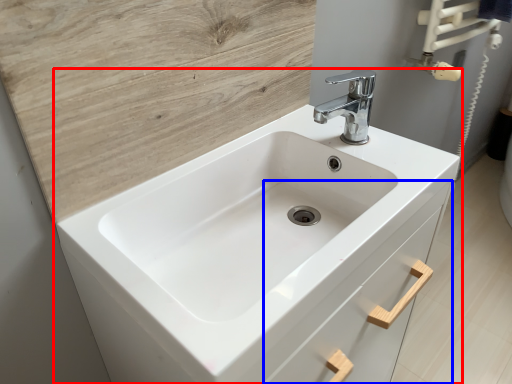
Question: Which object appears closest to the camera in this image, sink (highlighted by a red box) or drawer (highlighted by a blue box)?

Choices:
 (A) sink
 (B) drawer

Answer: (A)